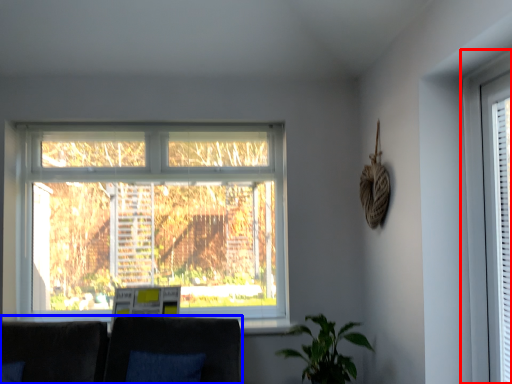
Question: Among these objects, which one is nearest to the camera, window (highlighted by a red box) or couch (highlighted by a blue box)?

Choices:
 (A) window
 (B) couch

Answer: (A)